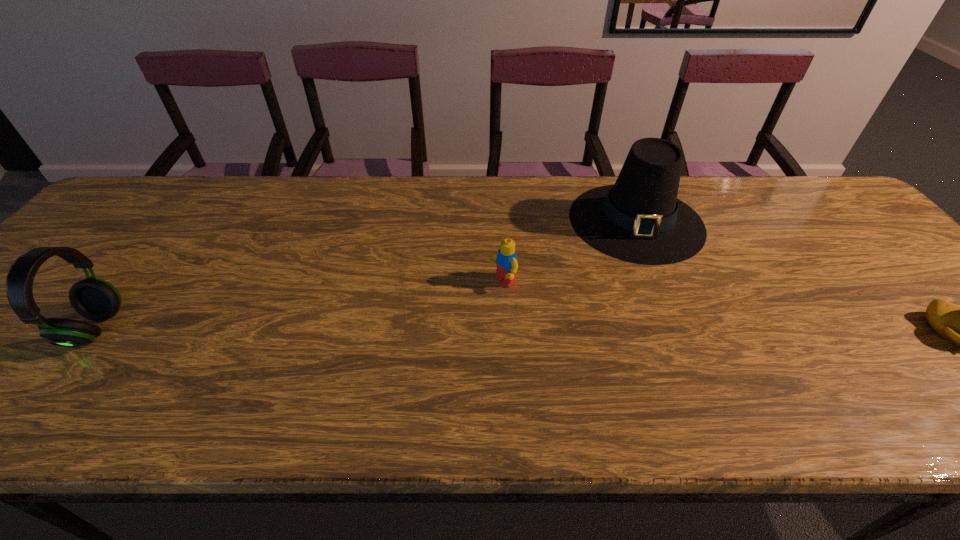
The width and height of the screenshot is (960, 540). I want to click on vacant area that lies between the second farthest object and the leftmost object, so click(299, 306).

You are a GUI agent. You are given a task and a screenshot of the screen. Output one action in this format:
    pyautogui.click(x=<x>, y=<y>)
    Task: Click on the blank region between the hat and the second object from left to right
    
    Given the screenshot: What is the action you would take?
    pyautogui.click(x=569, y=252)

Identify the location of vacant area that lies between the hat and the third nearest object. The image size is (960, 540). (569, 252).

In order to click on free spot between the second object from right to left and the leftmost object in this screenshot , I will do `click(366, 275)`.

This screenshot has width=960, height=540. I want to click on free space between the farthest object and the third object from right to left, so click(x=569, y=252).

The width and height of the screenshot is (960, 540). I want to click on object identified as the second closest to the duckling, so click(x=506, y=259).

Locate which object is the second closest to the Lego. Please provide its 2D coordinates. Your answer should be formatted as a tuple, i.e. [(x, y)], where the tuple contains the x and y coordinates of a point satisfying the conditions above.

[(95, 299)]

You are a GUI agent. You are given a task and a screenshot of the screen. Output one action in this format:
    pyautogui.click(x=<x>, y=<y>)
    Task: Click on the vacant area in the image that satisfies the following two spatial constraints: 1. on the back side of the second object from right to left; 2. on the right side of the Lego
    
    Given the screenshot: What is the action you would take?
    pyautogui.click(x=499, y=221)